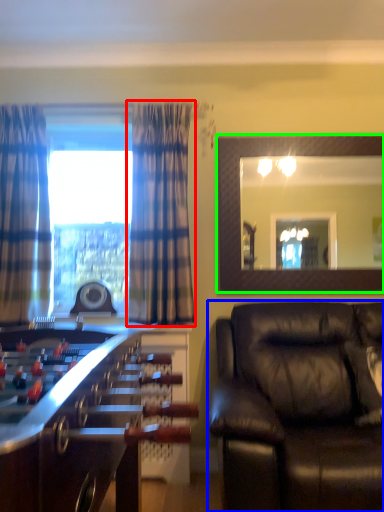
Question: Which is farther away from curtain (highlighted by a red box)? studio couch (highlighted by a blue box) or mirror (highlighted by a green box)?

Choices:
 (A) studio couch
 (B) mirror

Answer: (A)